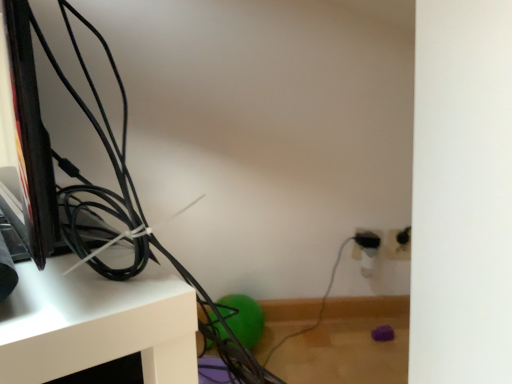
Question: Should I look upward or downward to see black plastic electric outlet at right, placed as the first electric outlet when sorted from left to right?

Choices:
 (A) down
 (B) up

Answer: (A)

Question: Is white glossy shelf at upper left touching black plastic electric outlet at right, placed as the first electric outlet when sorted from left to right?

Choices:
 (A) yes
 (B) no

Answer: (B)

Question: Considering the relative positions of white glossy shelf at upper left and black plastic electric outlet at right, marked as the second electric outlet in a right-to-left arrangement, in the image provided, is white glossy shelf at upper left in front of black plastic electric outlet at right, marked as the second electric outlet in a right-to-left arrangement,?

Choices:
 (A) yes
 (B) no

Answer: (A)

Question: Is white glossy shelf at upper left positioned behind black plastic electric outlet at right, placed as the first electric outlet when sorted from left to right?

Choices:
 (A) no
 (B) yes

Answer: (A)

Question: Does white glossy shelf at upper left have a greater width compared to black plastic electric outlet at right, marked as the second electric outlet in a right-to-left arrangement?

Choices:
 (A) yes
 (B) no

Answer: (A)

Question: From the image's perspective, is white glossy shelf at upper left under black plastic electric outlet at right, marked as the second electric outlet in a right-to-left arrangement?

Choices:
 (A) yes
 (B) no

Answer: (A)

Question: Can you confirm if white glossy shelf at upper left is thinner than black plastic electric outlet at right, placed as the first electric outlet when sorted from left to right?

Choices:
 (A) yes
 (B) no

Answer: (B)

Question: Considering the relative positions of white plastic electric outlet at lower right, the 1th electric outlet in the right-to-left sequence, and white glossy shelf at upper left in the image provided, is white plastic electric outlet at lower right, the 1th electric outlet in the right-to-left sequence, behind white glossy shelf at upper left?

Choices:
 (A) yes
 (B) no

Answer: (A)

Question: Does white plastic electric outlet at lower right, the 2th electric outlet from the left, have a larger size compared to white glossy shelf at upper left?

Choices:
 (A) no
 (B) yes

Answer: (A)

Question: From the image's perspective, would you say white plastic electric outlet at lower right, the 1th electric outlet in the right-to-left sequence, is shown under white glossy shelf at upper left?

Choices:
 (A) no
 (B) yes

Answer: (A)

Question: Is white plastic electric outlet at lower right, the 2th electric outlet from the left, wider than white glossy shelf at upper left?

Choices:
 (A) yes
 (B) no

Answer: (B)

Question: From the image's perspective, is white plastic electric outlet at lower right, the 2th electric outlet from the left, above white glossy shelf at upper left?

Choices:
 (A) no
 (B) yes

Answer: (B)

Question: Does white plastic electric outlet at lower right, the 2th electric outlet from the left, come in front of white glossy shelf at upper left?

Choices:
 (A) yes
 (B) no

Answer: (B)

Question: Is black plastic electric outlet at right, marked as the second electric outlet in a right-to-left arrangement, closer to camera compared to white glossy shelf at upper left?

Choices:
 (A) no
 (B) yes

Answer: (A)